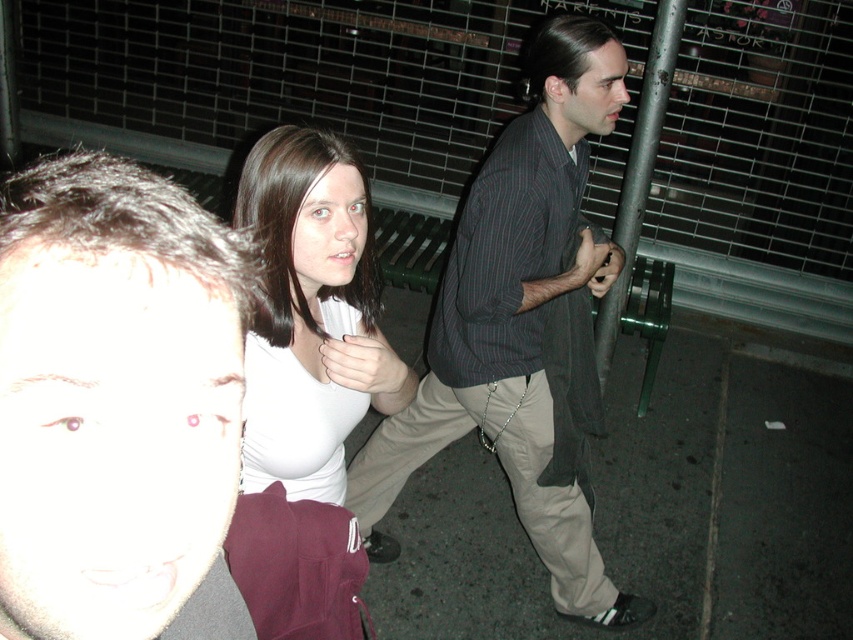
Who is more forward, (25, 502) or (326, 477)?

Positioned in front is point (25, 502).

Identify the location of smooth skin face at lower left. Image resolution: width=853 pixels, height=640 pixels. (113, 396).

Does khaki pants at center have a lesser height compared to white matte shirt at center?

No, khaki pants at center is not shorter than white matte shirt at center.

Can you confirm if khaki pants at center is thinner than white matte shirt at center?

Incorrect, khaki pants at center's width is not less than white matte shirt at center's.

Based on the photo, who is more distant from viewer, (543, 202) or (287, 147)?

Positioned behind is point (543, 202).

Image resolution: width=853 pixels, height=640 pixels. I want to click on khaki pants at center, so click(x=515, y=320).

Between point (94, 410) and point (433, 390), which one is positioned behind?

Positioned behind is point (433, 390).

The image size is (853, 640). What do you see at coordinates (113, 396) in the screenshot?
I see `smooth skin face at lower left` at bounding box center [113, 396].

Between point (100, 180) and point (567, 26), which one is positioned in front?

Point (100, 180)

The width and height of the screenshot is (853, 640). I want to click on smooth skin face at lower left, so pos(113,396).